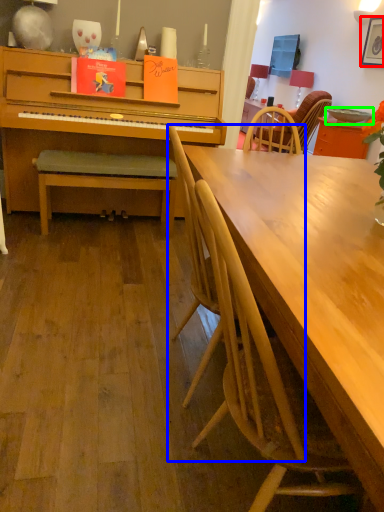
Question: Based on their relative distances, which object is nearer to picture frame (highlighted by a red box)? Choose from chair (highlighted by a blue box) and bowl (highlighted by a green box).

Choices:
 (A) chair
 (B) bowl

Answer: (B)